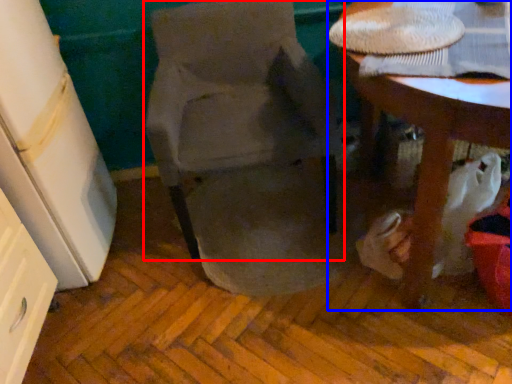
Question: Among these objects, which one is farthest to the camera, chair (highlighted by a red box) or table (highlighted by a blue box)?

Choices:
 (A) chair
 (B) table

Answer: (A)